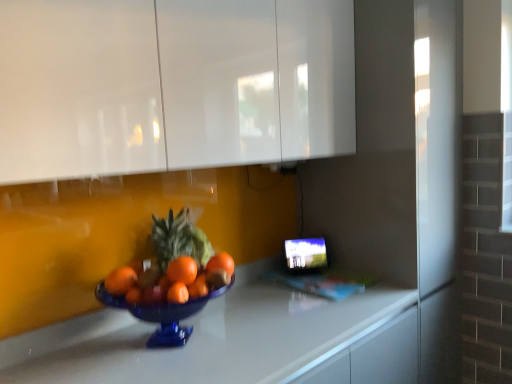
Question: Considering the relative positions of white glossy countertop at center and white glossy cabinets at upper center in the image provided, is white glossy countertop at center to the left or to the right of white glossy cabinets at upper center?

Choices:
 (A) left
 (B) right

Answer: (B)

Question: In the image, is white glossy countertop at center positioned in front of or behind white glossy cabinets at upper center?

Choices:
 (A) front
 (B) behind

Answer: (A)

Question: From their relative heights in the image, would you say white glossy countertop at center is taller or shorter than white glossy cabinets at upper center?

Choices:
 (A) tall
 (B) short

Answer: (B)

Question: Is white glossy cabinets at upper center to the left or to the right of white glossy countertop at center in the image?

Choices:
 (A) right
 (B) left

Answer: (B)

Question: Is white glossy cabinets at upper center wider or thinner than white glossy countertop at center?

Choices:
 (A) thin
 (B) wide

Answer: (A)

Question: Is white glossy cabinets at upper center taller or shorter than white glossy countertop at center?

Choices:
 (A) short
 (B) tall

Answer: (B)

Question: Choose the correct answer: Is white glossy cabinets at upper center inside white glossy countertop at center or outside it?

Choices:
 (A) inside
 (B) outside

Answer: (B)